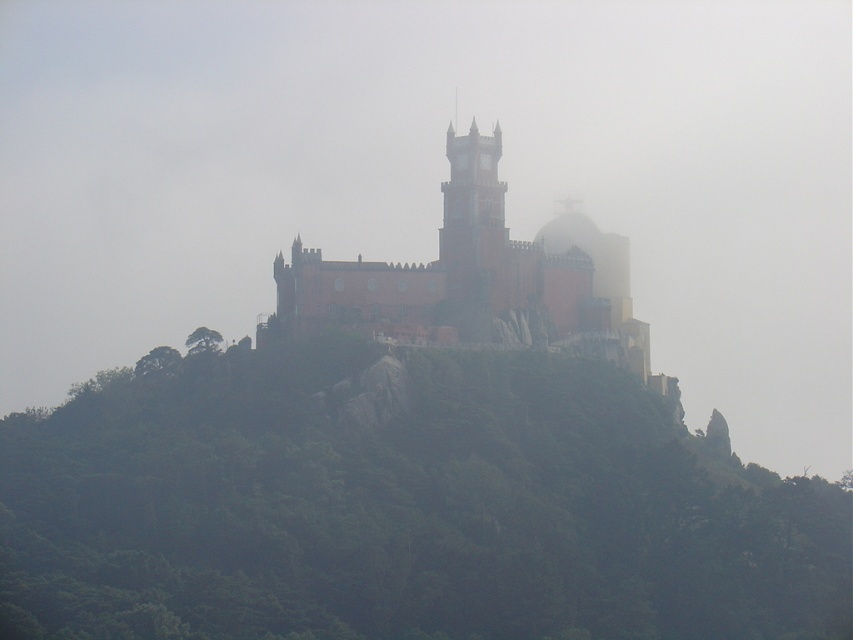
You are an architect assessing the structural stability of the matte pink stone castle at center and the matte pink stone tower at center. Based on their widths, which one might have a larger base area for better support?

The matte pink stone castle at center might have a larger base area for better support since it is wider than the matte pink stone tower at center according to the description.

You are a hiker who wants to reach the top of the hill where the matte pink stone castle at center is located. From your current position at the bottom of the green leafy hillside at center, which object is closer to the top?

The matte pink stone castle at center is closer to the top of the hill than the green leafy hillside at center because the hillside is part of the hill itself, and the castle is situated atop it.

You are standing at the base of the hill looking up at the castle. You notice two points marked on the image. Which point, point (x=647, y=560) or point (x=500, y=141), is closer to you?

Point (x=647, y=560) is closer to the viewer than point (x=500, y=141).